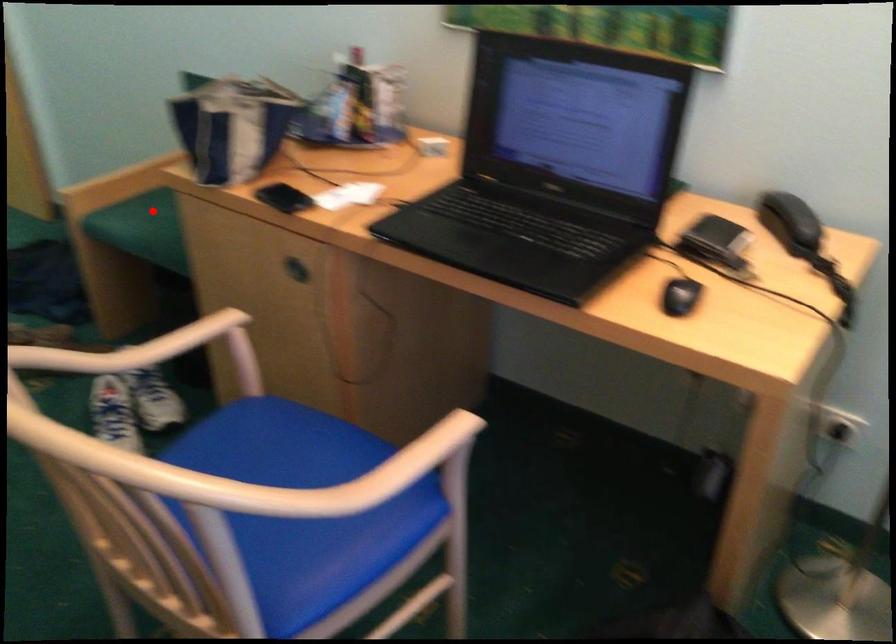
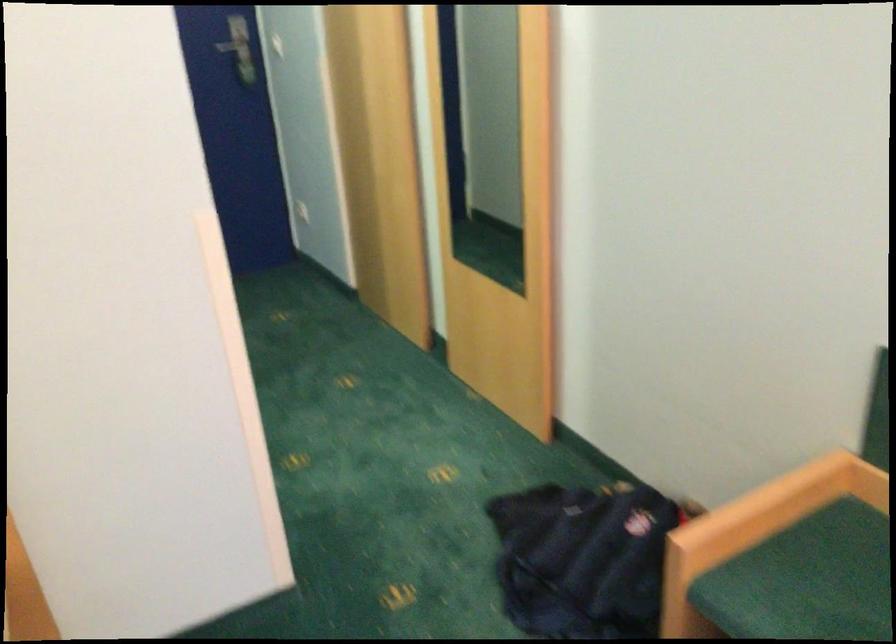
Question: I am providing you with two images of the same scene from different viewpoints. Given a red point in image1, look at the same physical point in image2. Is it:

Choices:
 (A) Closer to the viewpoint
 (B) Farther from the viewpoint

Answer: (A)